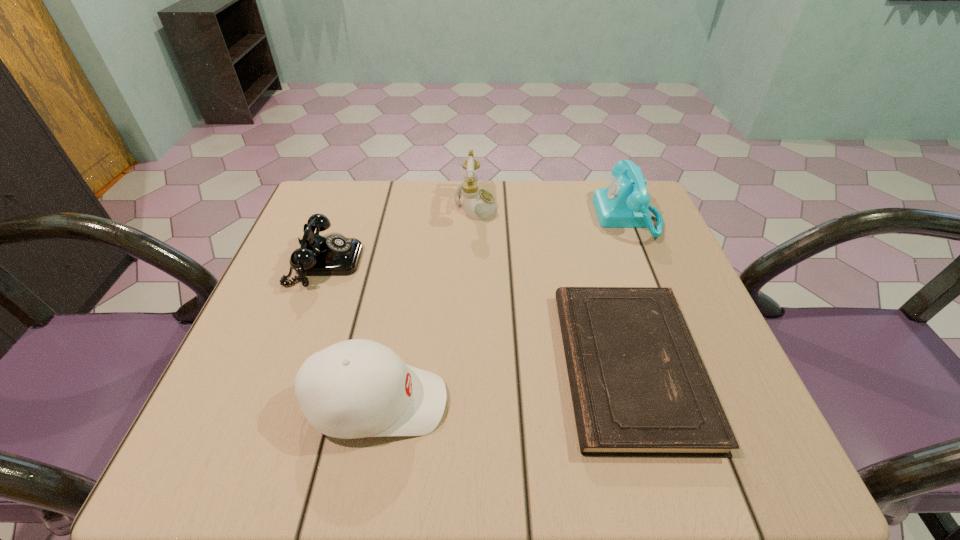
The image size is (960, 540). What are the coordinates of `free space at the far edge of the desktop` in the screenshot? It's located at (544, 192).

Where is `free point at the near edge`? free point at the near edge is located at coordinates (497, 454).

This screenshot has height=540, width=960. In order to click on free point at the left edge in this screenshot , I will do `click(243, 336)`.

What are the coordinates of `vacant space at the right edge of the desktop` in the screenshot? It's located at (683, 288).

You are a GUI agent. You are given a task and a screenshot of the screen. Output one action in this format:
    pyautogui.click(x=<x>, y=<y>)
    Task: Click on the vacant space at the far left corner of the desktop
    The height and width of the screenshot is (540, 960).
    Given the screenshot: What is the action you would take?
    pyautogui.click(x=320, y=201)

This screenshot has width=960, height=540. In the image, there is a desktop. In order to click on free space at the near left corner in this screenshot , I will do `click(280, 463)`.

Where is `vacant region at the far right corner`? This screenshot has height=540, width=960. vacant region at the far right corner is located at coordinates (599, 227).

This screenshot has height=540, width=960. I want to click on free space that is in between the shortest telephone and the second telephone from right to left, so click(400, 233).

You are a GUI agent. You are given a task and a screenshot of the screen. Output one action in this format:
    pyautogui.click(x=<x>, y=<y>)
    Task: Click on the empty space between the rightmost telephone and the baseball cap
    This screenshot has height=540, width=960.
    Given the screenshot: What is the action you would take?
    pyautogui.click(x=502, y=310)

This screenshot has width=960, height=540. What are the coordinates of `unoccupied position between the fourth tallest object and the paperback book` in the screenshot? It's located at (477, 314).